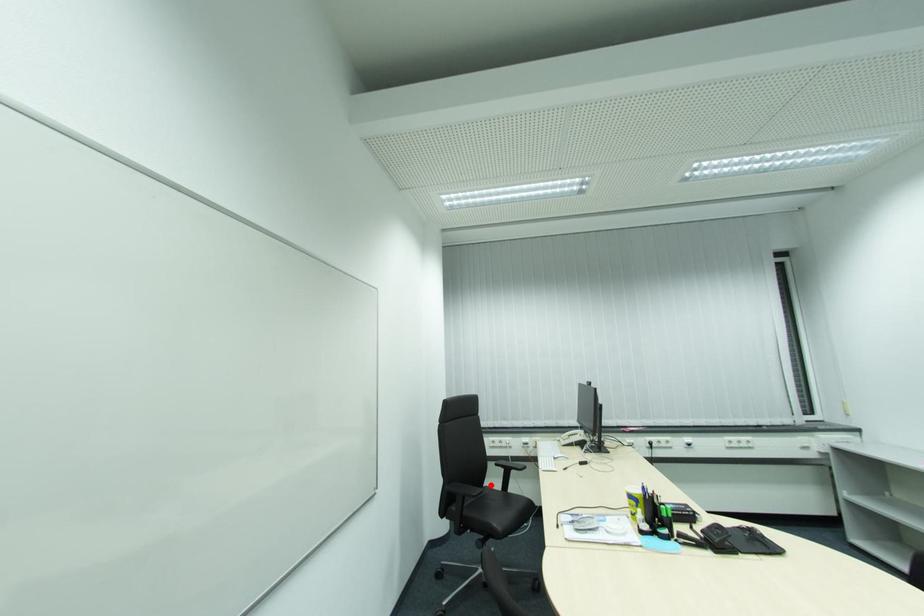
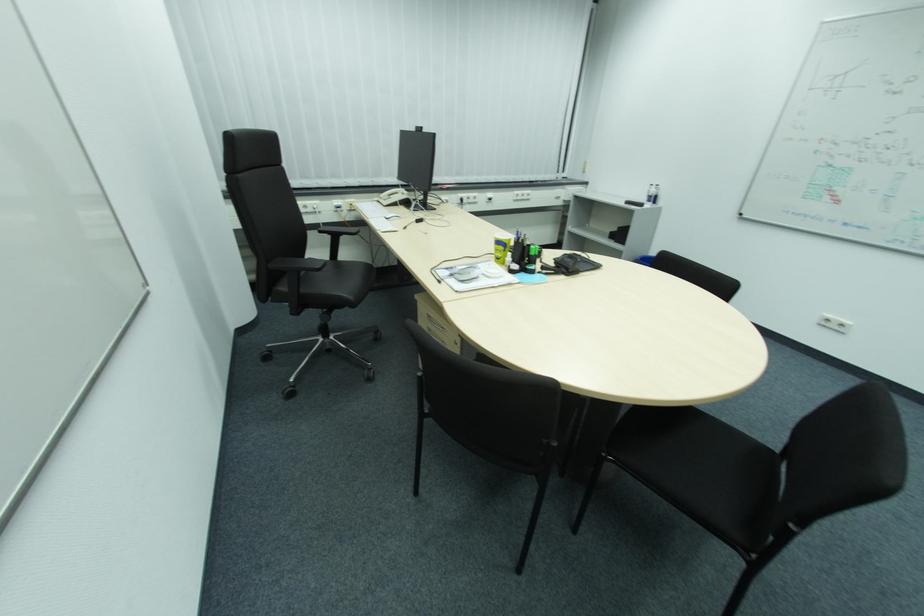
Question: I am providing you with two images of the same scene from different viewpoints. In image1, a red point is highlighted. Considering the same 3D point in image2, which of the following is correct?

Choices:
 (A) It is closer
 (B) It is farther

Answer: (A)